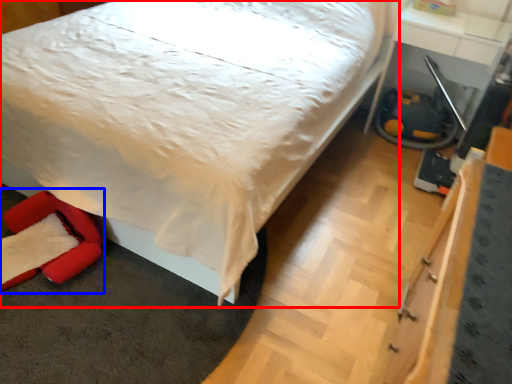
Question: Among these objects, which one is nearest to the camera, bed (highlighted by a red box) or swivel chair (highlighted by a blue box)?

Choices:
 (A) bed
 (B) swivel chair

Answer: (A)